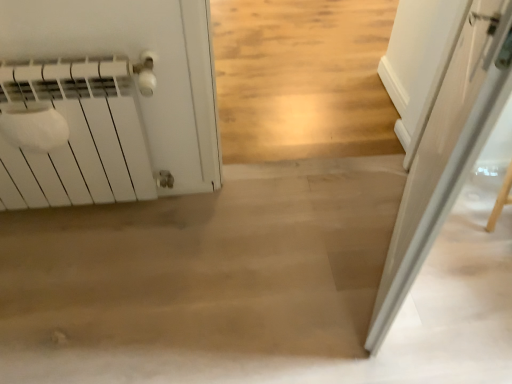
Where is `free point below white glossy door at right (from a real-world perspective)`? free point below white glossy door at right (from a real-world perspective) is located at coordinates (378, 251).